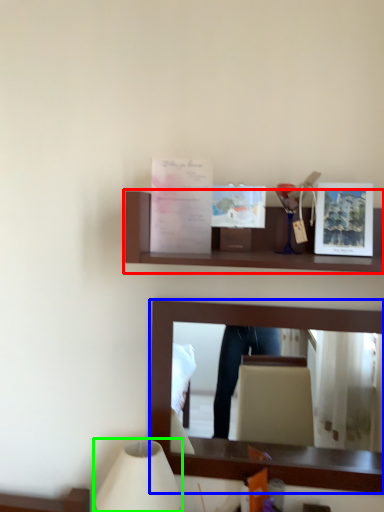
Question: Based on their relative distances, which object is nearer to shelf (highlighted by a red box)? Choose from mirror (highlighted by a blue box) and table lamp (highlighted by a green box).

Choices:
 (A) mirror
 (B) table lamp

Answer: (A)